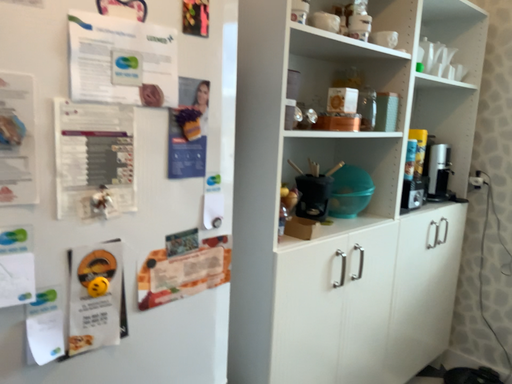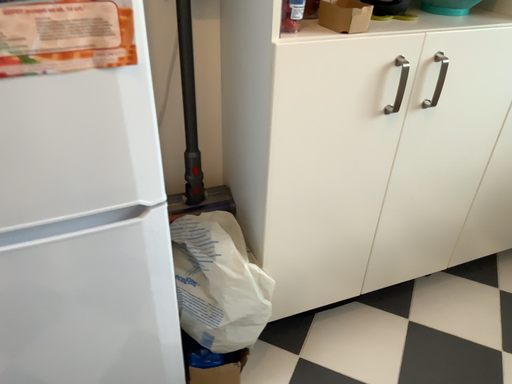
Question: Which way did the camera rotate in the video?

Choices:
 (A) rotated left
 (B) rotated right

Answer: (A)